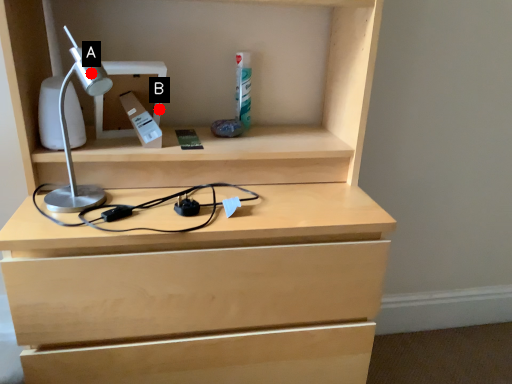
Question: Two points are circled on the image, labeled by A and B beside each circle. Which of the following is the closest to the observer?

Choices:
 (A) A is closer
 (B) B is closer

Answer: (A)